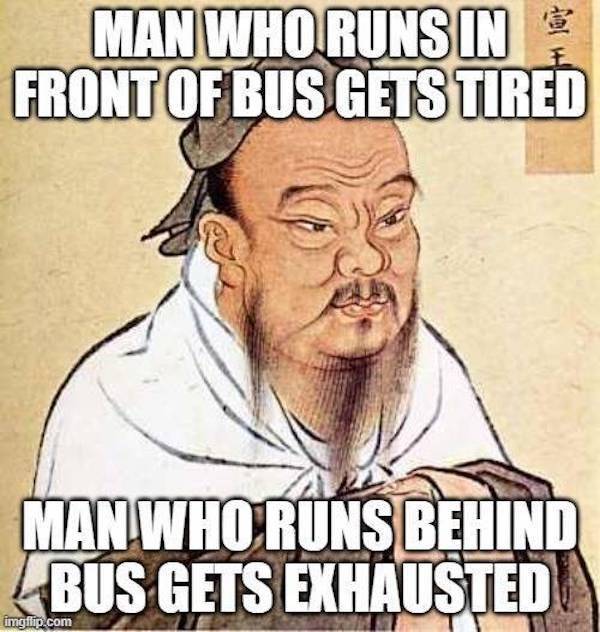
In order to click on robe in this screenshot , I will do `click(144, 422)`.